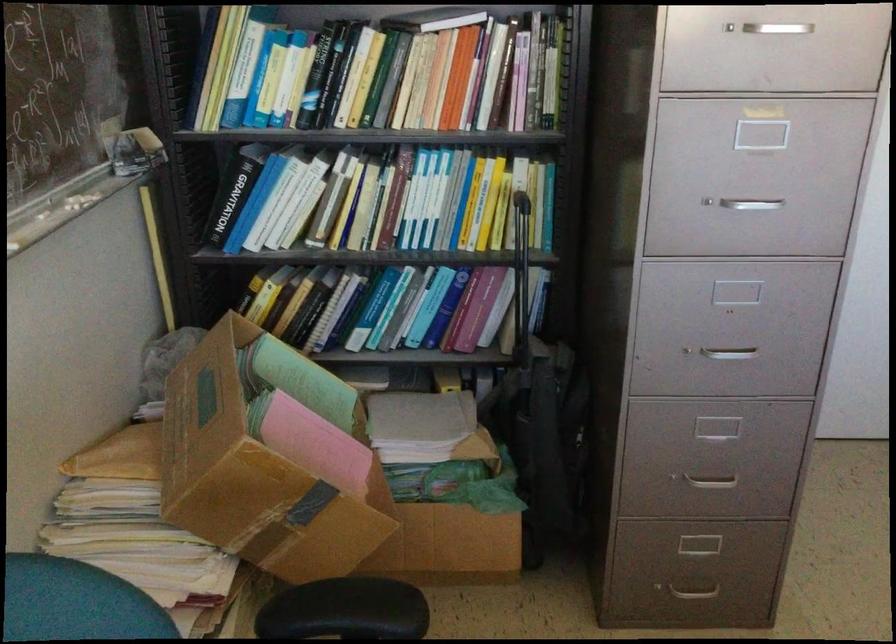
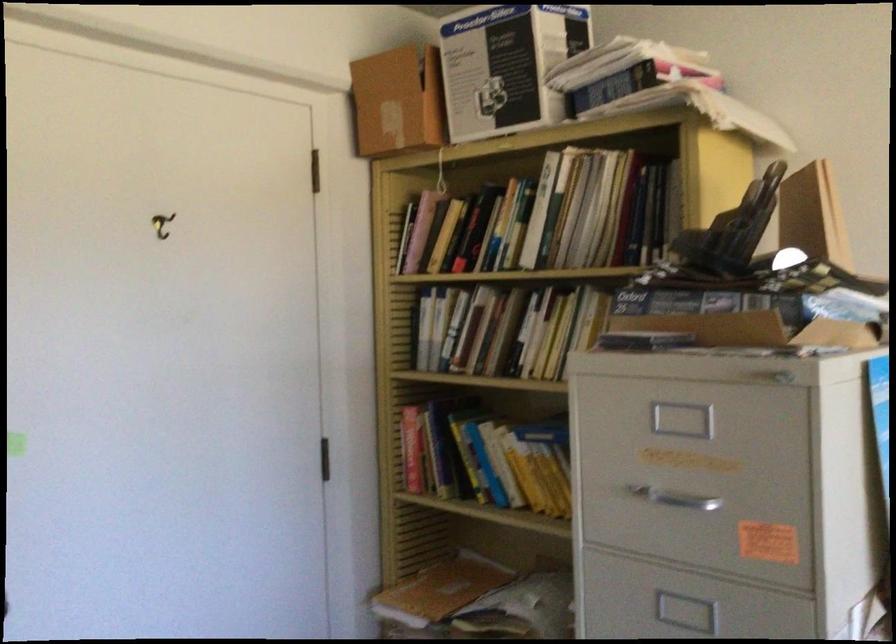
Question: The camera is either moving clockwise (left) or counter-clockwise (right) around the object. The first image is from the beginning of the video and the second image is from the end. Is the camera moving left or right when shooting the video?

Choices:
 (A) Left
 (B) Right

Answer: (A)